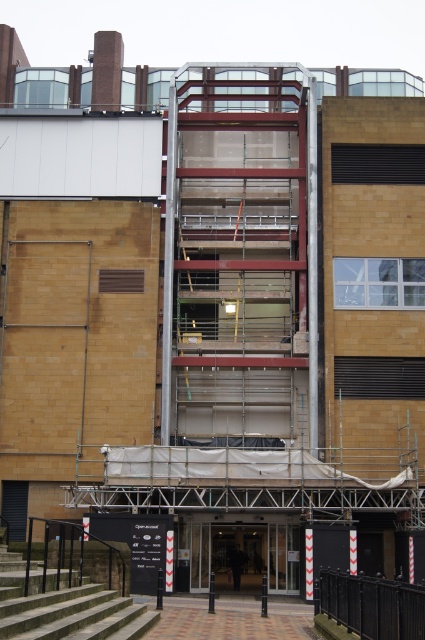
You are a delivery person trying to access the entrance of the building. You see the concrete stairs at lower left and the black metal fence at lower right. Which object is closer to the entrance?

The concrete stairs at lower left are closer to the entrance because the black metal fence at lower right is behind them, indicating the stairs are in front and nearer to the entrance.

You are a construction worker standing at the base of the building. You notice two points marked on the scaffolding, point (243, 218) and point (408, 588). Which point is closer to you?

Point (243, 218) is closer to you because it is further to the viewer than point (408, 588).

You are a construction worker needing to access the building from the concrete stairs at lower left. Which direction should you move to reach the metallic scaffolding at center?

You should move to your right to reach the metallic scaffolding at center since it is located to the right of the concrete stairs at lower left.